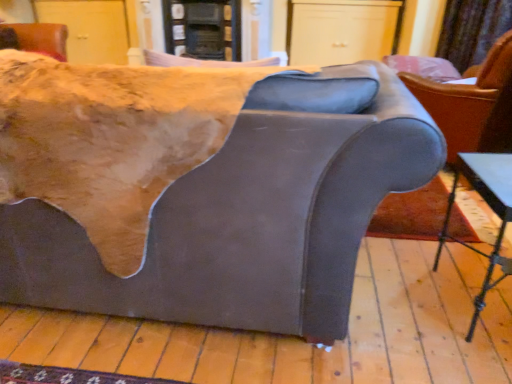
This screenshot has width=512, height=384. Identify the location of vacant area to the left of metallic silver table at lower right. (404, 302).